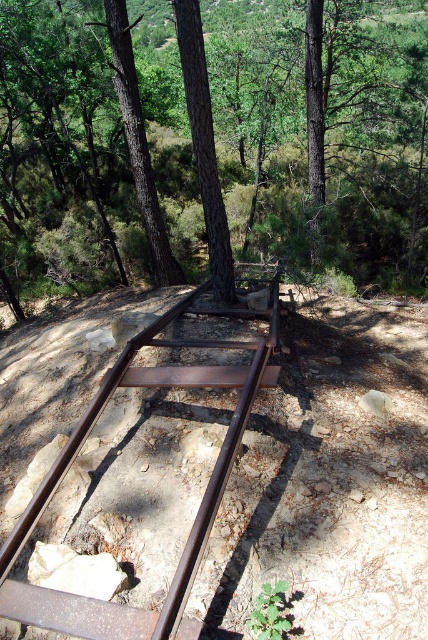
Which is behind, point (133, 156) or point (137, 109)?

The point (133, 156) is more distant.

Is point (208, 205) more distant than point (110, 48)?

No.

Find the location of a particular element. The image size is (428, 640). green leafy trees at upper center is located at coordinates (210, 145).

Who is shorter, brown wood tree at center or brown textured wood at upper center?

brown wood tree at center

Who is lower down, brown wood tree at center or brown textured wood at upper center?

brown wood tree at center is below.

Is point (190, 76) less distant than point (151, 236)?

Yes, it is.

At what (x,y) coordinates should I click in order to perform the action: click on brown wood tree at center. Please return your answer as a coordinate pair (x, y). This screenshot has height=640, width=428. Looking at the image, I should click on (205, 147).

Does point (192, 109) lie in front of point (196, 154)?

That is True.

This screenshot has height=640, width=428. I want to click on green leafy trees at upper center, so click(210, 145).